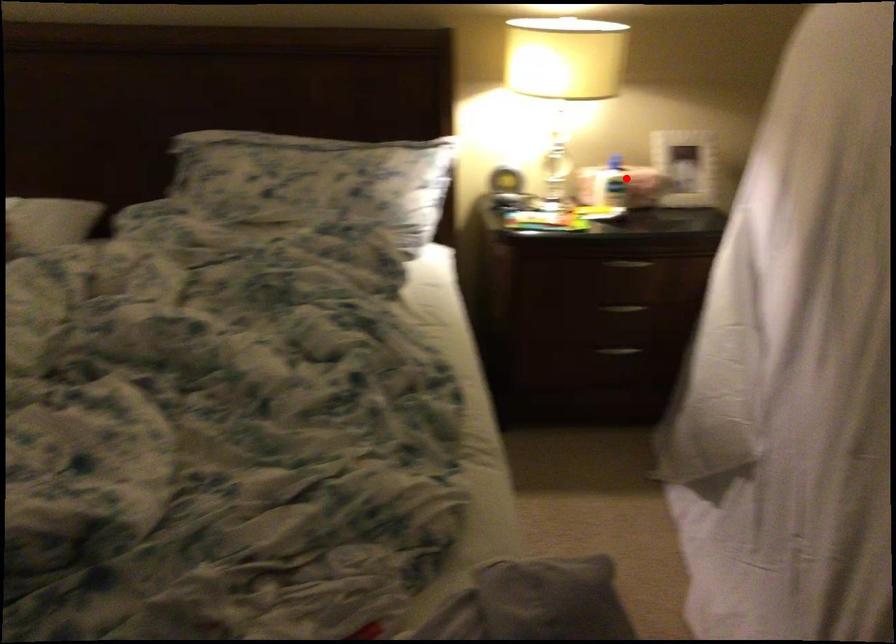
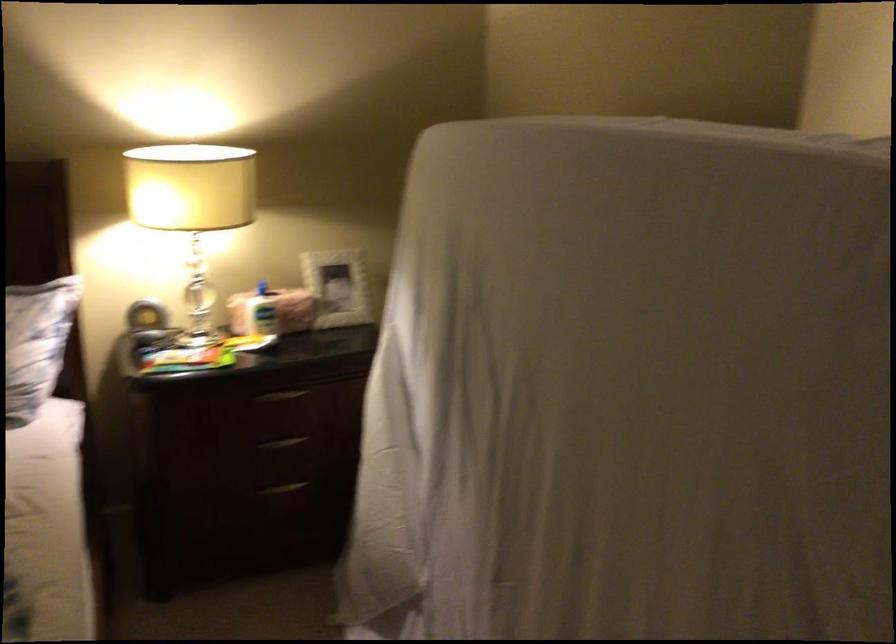
The point at the highlighted location is marked in the first image. Where is the corresponding point in the second image?

(273, 310)